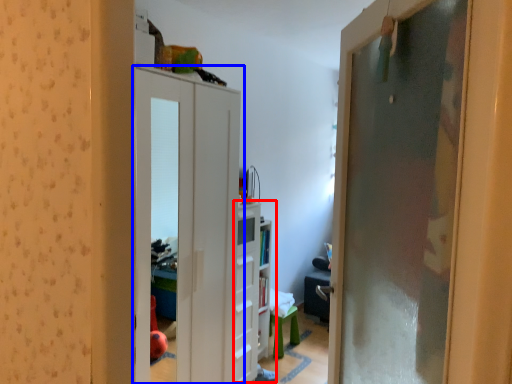
Question: Which object is closer to the camera taking this photo, dresser (highlighted by a red box) or door (highlighted by a blue box)?

Choices:
 (A) dresser
 (B) door

Answer: (B)